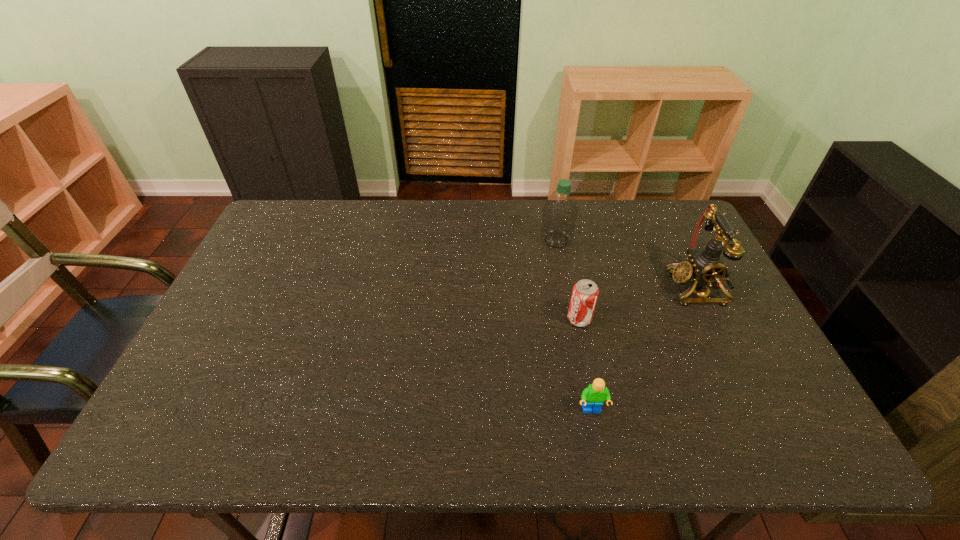
Find the location of a particular element. Image resolution: width=960 pixels, height=540 pixels. unoccupied position between the Lego and the rightmost object is located at coordinates (644, 348).

I want to click on empty location between the nearest object and the water bottle, so click(574, 325).

Locate an element on the screen. This screenshot has height=540, width=960. unoccupied area between the farthest object and the telephone is located at coordinates (626, 264).

Where is `free space between the shortest object and the rightmost object`? The image size is (960, 540). free space between the shortest object and the rightmost object is located at coordinates pyautogui.click(x=644, y=348).

Locate an element on the screen. This screenshot has height=540, width=960. free space between the telephone and the farthest object is located at coordinates tap(626, 264).

Where is `vacant area that lies between the farthest object and the third tallest object`? vacant area that lies between the farthest object and the third tallest object is located at coordinates (567, 280).

Locate an element on the screen. Image resolution: width=960 pixels, height=540 pixels. empty space that is in between the shortest object and the water bottle is located at coordinates (574, 325).

In order to click on free space that is in between the telephone and the shortest object in this screenshot , I will do `click(644, 348)`.

I want to click on free space between the telephone and the nearest object, so click(644, 348).

Select which object appears as the second closest to the farthest object. Please provide its 2D coordinates. Your answer should be formatted as a tuple, i.e. [(x, y)], where the tuple contains the x and y coordinates of a point satisfying the conditions above.

[(705, 267)]